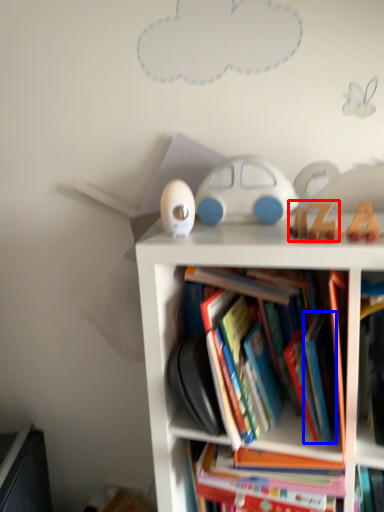
Question: Among these objects, which one is nearest to the camera, toy (highlighted by a red box) or paperback book (highlighted by a blue box)?

Choices:
 (A) toy
 (B) paperback book

Answer: (B)